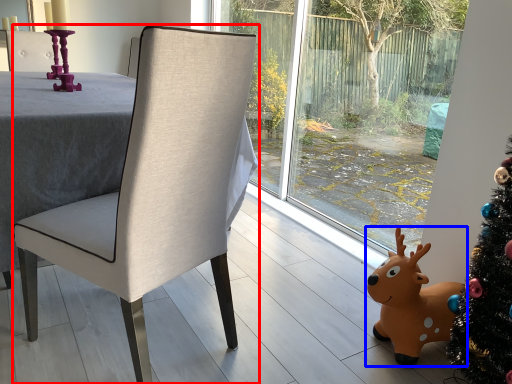
Question: Among these objects, which one is farthest to the camera, chair (highlighted by a red box) or deer (highlighted by a blue box)?

Choices:
 (A) chair
 (B) deer

Answer: (B)